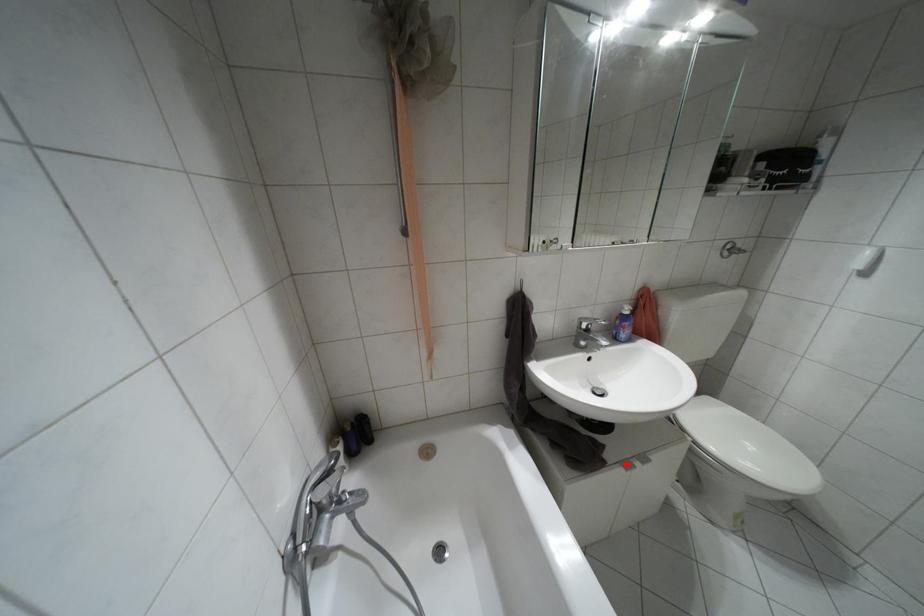
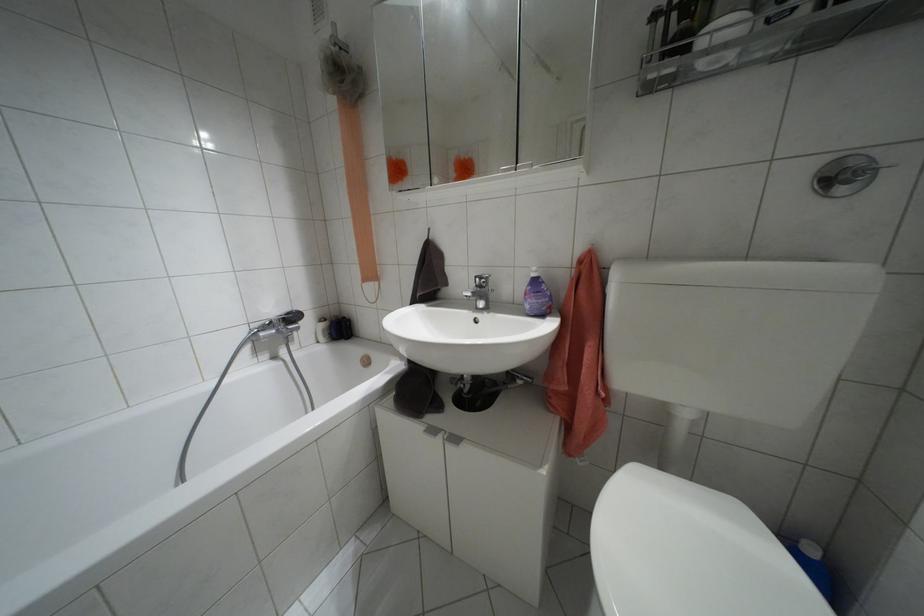
Locate, in the second image, the point that corresponds to the highlighted location in the first image.

(432, 430)